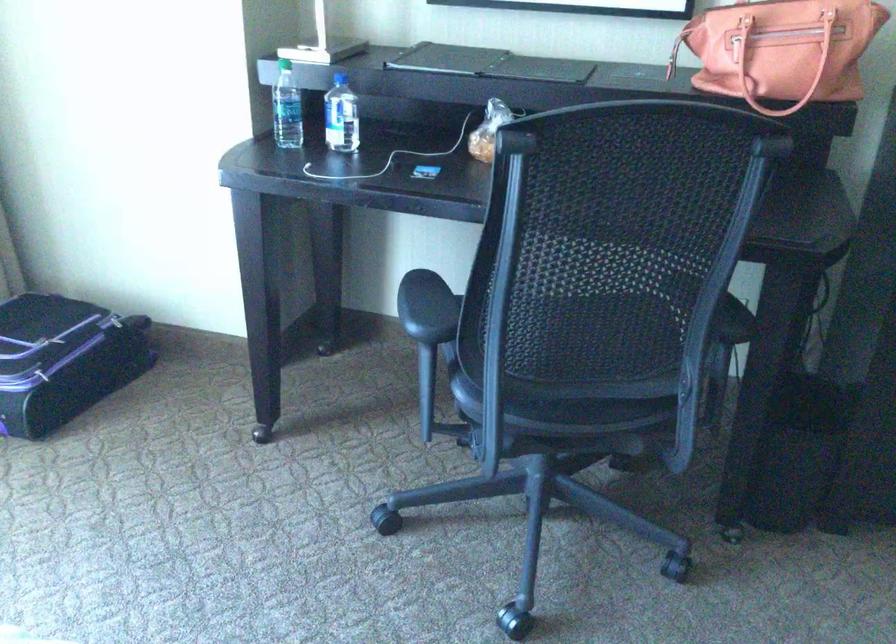
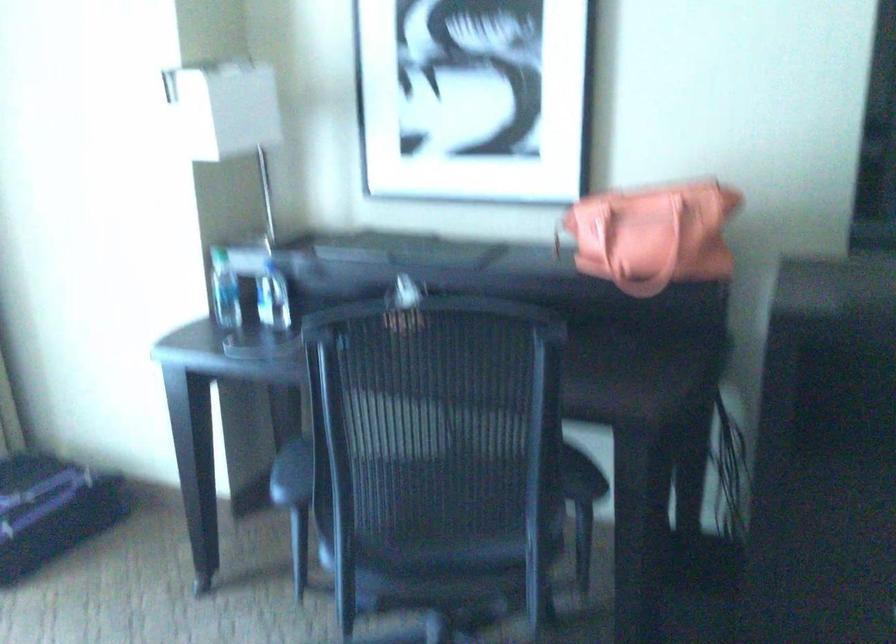
The point at (599, 377) is marked in the first image. Where is the corresponding point in the second image?

(458, 544)